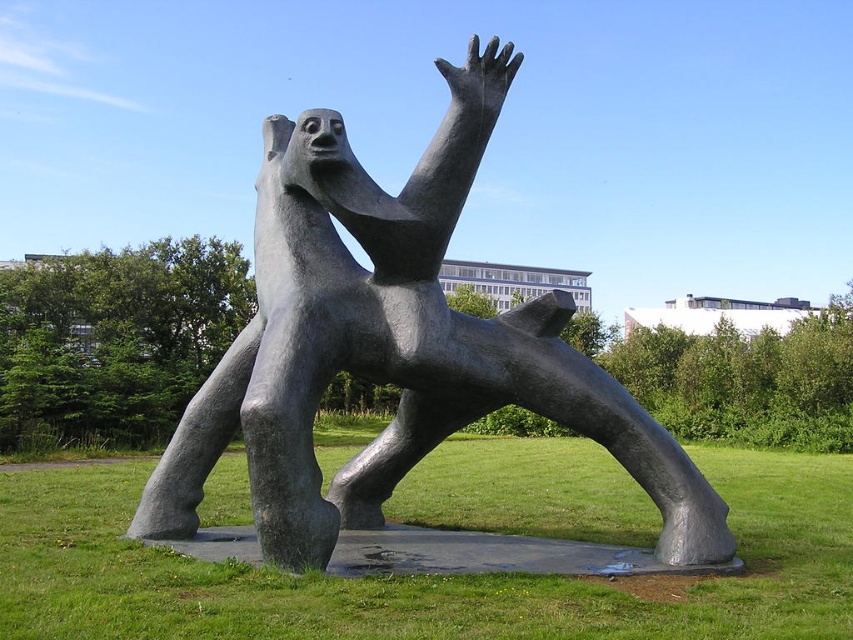
You are standing at the origin point of the coordinate system where the polished bronze sculpture at center is located at point 0.544, 0.462. If you want to move directly towards the sculpture, which direction should you move in terms of the coordinate system?

To move directly towards the polished bronze sculpture at center located at point (393,348) from the origin, you should move in the positive x and positive y direction since the coordinates are both greater than zero.

You are a photographer wanting to capture the polished bronze sculpture at center and the green grass at center in your shot. Which object should you focus on first if you want to ensure both are in focus without changing your camera settings?

The green grass at center is behind the polished bronze sculpture at center, so you should focus on the polished bronze sculpture at center first to ensure both are in focus.